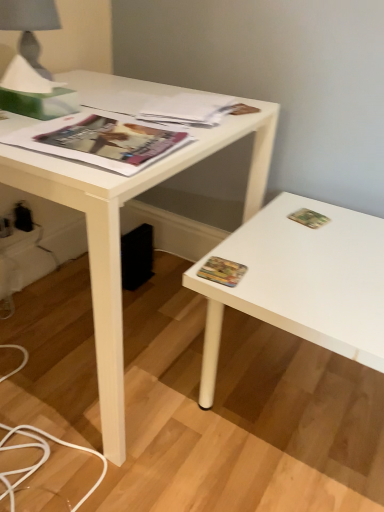
How much space does black plastic electric outlet at lower left, the 2th electric outlet viewed from the front, occupy horizontally?

0.81 inches.

Describe the element at coordinates (222, 271) in the screenshot. I see `multicolored paper at right, which appears as the 2th paperback book when viewed from the back` at that location.

Describe the element at coordinates (6, 226) in the screenshot. I see `white plastic electric outlet at lower left, arranged as the second electric outlet when viewed from the back` at that location.

Locate an element on the screen. The height and width of the screenshot is (512, 384). white plastic electric outlet at lower left, arranged as the second electric outlet when viewed from the back is located at coordinates (6, 226).

The width and height of the screenshot is (384, 512). What do you see at coordinates (309, 218) in the screenshot?
I see `green matte paperback book at upper right, the first paperback book when ordered from right to left` at bounding box center [309, 218].

Locate an element on the screen. The height and width of the screenshot is (512, 384). matte paper magazine at upper center, the 1th magazine viewed from the back is located at coordinates (165, 106).

I want to click on white matte desk at center, so click(119, 230).

Where is `black plastic electric outlet at lower left, which ranks as the 1th electric outlet in back-to-front order`? The image size is (384, 512). black plastic electric outlet at lower left, which ranks as the 1th electric outlet in back-to-front order is located at coordinates [x=23, y=217].

Can black plastic electric outlet at lower left, which ranks as the 1th electric outlet in back-to-front order, be found inside green matte paperback book at upper right, which ranks as the 2th paperback book in front-to-back order?

No, black plastic electric outlet at lower left, which ranks as the 1th electric outlet in back-to-front order, is located outside of green matte paperback book at upper right, which ranks as the 2th paperback book in front-to-back order.

Considering the relative positions of green matte paperback book at upper right, the second paperback book from the left, and black plastic electric outlet at lower left, which ranks as the 1th electric outlet in back-to-front order, in the image provided, is green matte paperback book at upper right, the second paperback book from the left, behind black plastic electric outlet at lower left, which ranks as the 1th electric outlet in back-to-front order,?

No, it is not.

Does matte gray fabric at upper left appear on the right side of matte paper magazine at upper center, the second magazine from the front?

No, matte gray fabric at upper left is not to the right of matte paper magazine at upper center, the second magazine from the front.

Is matte gray fabric at upper left not within matte paper magazine at upper center, the 1th magazine viewed from the back?

matte gray fabric at upper left is positioned outside matte paper magazine at upper center, the 1th magazine viewed from the back.

Does matte gray fabric at upper left have a larger size compared to matte paper magazine at upper center, the second magazine from the front?

Indeed, matte gray fabric at upper left has a larger size compared to matte paper magazine at upper center, the second magazine from the front.

Is point (53, 22) positioned behind point (198, 99)?

No, it is not.

Can you tell me how much white matte desk at center and white plastic electric outlet at lower left, which ranks as the 1th electric outlet in front-to-back order, differ in facing direction?

The angular difference between white matte desk at center and white plastic electric outlet at lower left, which ranks as the 1th electric outlet in front-to-back order, is 2.25 degrees.

Is white matte desk at center surrounding white plastic electric outlet at lower left, which ranks as the 1th electric outlet in front-to-back order?

Yes, white plastic electric outlet at lower left, which ranks as the 1th electric outlet in front-to-back order, can be found within white matte desk at center.

Which of these two, white matte desk at center or white plastic electric outlet at lower left, which ranks as the 1th electric outlet in front-to-back order, is thinner?

Thinner between the two is white plastic electric outlet at lower left, which ranks as the 1th electric outlet in front-to-back order.

From the image's perspective, would you say black plastic electric outlet at lower left, which ranks as the 1th electric outlet in back-to-front order, is positioned over white matte desk at center?

Yes, from the image's perspective, black plastic electric outlet at lower left, which ranks as the 1th electric outlet in back-to-front order, is above white matte desk at center.

From a real-world perspective, is black plastic electric outlet at lower left, the 2th electric outlet viewed from the front, positioned under white matte desk at center based on gravity?

Yes, from a real-world perspective, black plastic electric outlet at lower left, the 2th electric outlet viewed from the front, is beneath white matte desk at center.

Which object is wider, black plastic electric outlet at lower left, which ranks as the 1th electric outlet in back-to-front order, or white matte desk at center?

With larger width is white matte desk at center.

Is matte gray fabric at upper left at the right side of white plastic electric outlet at lower left, which ranks as the 1th electric outlet in front-to-back order?

Yes, matte gray fabric at upper left is to the right of white plastic electric outlet at lower left, which ranks as the 1th electric outlet in front-to-back order.

Is matte gray fabric at upper left next to white plastic electric outlet at lower left, arranged as the second electric outlet when viewed from the back, and touching it?

No, matte gray fabric at upper left is not beside white plastic electric outlet at lower left, arranged as the second electric outlet when viewed from the back.

Could you tell me if matte gray fabric at upper left is facing white plastic electric outlet at lower left, arranged as the second electric outlet when viewed from the back?

No, matte gray fabric at upper left is not facing towards white plastic electric outlet at lower left, arranged as the second electric outlet when viewed from the back.

Who is shorter, matte gray fabric at upper left or white plastic electric outlet at lower left, which ranks as the 1th electric outlet in front-to-back order?

Standing shorter between the two is white plastic electric outlet at lower left, which ranks as the 1th electric outlet in front-to-back order.

What's the angular difference between matte gray fabric at upper left and white matte desk at center's facing directions?

There is a 2.24-degree angle between the facing directions of matte gray fabric at upper left and white matte desk at center.

Is matte gray fabric at upper left touching white matte desk at center?

No, matte gray fabric at upper left is not next to white matte desk at center.

How distant is matte gray fabric at upper left from white matte desk at center?

38.10 centimeters.

Based on the photo, considering the positions of objects matte gray fabric at upper left and white matte desk at center in the image provided, who is more to the right, matte gray fabric at upper left or white matte desk at center?

From the viewer's perspective, white matte desk at center appears more on the right side.

From the image's perspective, is white matte desk at center above or below matte gray fabric at upper left?

Based on their image positions, white matte desk at center is located beneath matte gray fabric at upper left.

Could you tell me if white matte desk at center is facing matte gray fabric at upper left?

No, white matte desk at center is not oriented towards matte gray fabric at upper left.

Considering their positions, is white matte desk at center located in front of or behind matte gray fabric at upper left?

Clearly, white matte desk at center is in front of matte gray fabric at upper left.

Between white matte desk at center and matte gray fabric at upper left, which one has larger width?

Wider between the two is white matte desk at center.

The width and height of the screenshot is (384, 512). I want to click on the 2nd paperback book to the right of the black plastic electric outlet at lower left, the 2th electric outlet viewed from the front, starting your count from the anchor, so click(x=309, y=218).

You are a GUI agent. You are given a task and a screenshot of the screen. Output one action in this format:
    pyautogui.click(x=<x>, y=<y>)
    Task: Click on the table lamp on the left of matte paper magazine at upper center, the 1th magazine viewed from the back
    This screenshot has height=512, width=384.
    Given the screenshot: What is the action you would take?
    pyautogui.click(x=29, y=26)

From the image, which object appears to be farther from matte paper magazine at upper left, which is counted as the second magazine, starting from the back, green matte paperback book at upper right, placed as the first paperback book when sorted from back to front, or white matte desk at center?

green matte paperback book at upper right, placed as the first paperback book when sorted from back to front.

From the picture: From the image, which object appears to be farther from black plastic electric outlet at lower left, which ranks as the 1th electric outlet in back-to-front order, multicolored paper at right, arranged as the first paperback book when ordered from the bottom, or white matte desk at center?

multicolored paper at right, arranged as the first paperback book when ordered from the bottom.

Based on their spatial positions, is matte gray fabric at upper left or multicolored paper at right, arranged as the first paperback book when ordered from the bottom, further from black plastic electric outlet at lower left, which ranks as the 1th electric outlet in back-to-front order?

multicolored paper at right, arranged as the first paperback book when ordered from the bottom.

In the scene shown: Looking at the image, which one is located further to matte gray fabric at upper left, white plastic electric outlet at lower left, which ranks as the 1th electric outlet in front-to-back order, or matte paper magazine at upper center, the 1th magazine viewed from the back?

The object further to matte gray fabric at upper left is white plastic electric outlet at lower left, which ranks as the 1th electric outlet in front-to-back order.

Which object lies nearer to the anchor point matte paper magazine at upper center, the 1th magazine viewed from the back, green matte paperback book at upper right, the second paperback book from the left, or matte gray fabric at upper left?

Based on the image, matte gray fabric at upper left appears to be nearer to matte paper magazine at upper center, the 1th magazine viewed from the back.

From the image, which object appears to be farther from multicolored paper at right, which appears as the 2th paperback book when viewed from the back, matte paper magazine at upper left, positioned as the first magazine in front-to-back order, or matte paper magazine at upper center, the 1th magazine viewed from the back?

matte paper magazine at upper center, the 1th magazine viewed from the back, lies further to multicolored paper at right, which appears as the 2th paperback book when viewed from the back, than the other object.

Consider the image. Which object lies further to the anchor point white matte desk at center, matte paper magazine at upper left, positioned as the first magazine in front-to-back order, or white plastic electric outlet at lower left, arranged as the second electric outlet when viewed from the back?

white plastic electric outlet at lower left, arranged as the second electric outlet when viewed from the back.

Which object lies nearer to the anchor point multicolored paper at right, arranged as the first paperback book when ordered from the bottom, matte paper magazine at upper center, the 1th magazine viewed from the back, or white plastic electric outlet at lower left, which ranks as the 1th electric outlet in front-to-back order?

The object closer to multicolored paper at right, arranged as the first paperback book when ordered from the bottom, is matte paper magazine at upper center, the 1th magazine viewed from the back.

Identify the location of electric outlet between white plastic electric outlet at lower left, arranged as the second electric outlet when viewed from the back, and matte paper magazine at upper center, the 1th magazine viewed from the back, from left to right. The image size is (384, 512). (23, 217).

Where is `table lamp between white matte desk at center and black plastic electric outlet at lower left, which ranks as the 1th electric outlet in back-to-front order, along the z-axis`? This screenshot has height=512, width=384. table lamp between white matte desk at center and black plastic electric outlet at lower left, which ranks as the 1th electric outlet in back-to-front order, along the z-axis is located at coordinates 29,26.

Image resolution: width=384 pixels, height=512 pixels. I want to click on table lamp between black plastic electric outlet at lower left, which ranks as the 1th electric outlet in back-to-front order, and green matte paperback book at upper right, the first paperback book when ordered from right to left, from left to right, so 29,26.

Where is `paperback book between matte gray fabric at upper left and green matte paperback book at upper right, the second paperback book from the left, in the horizontal direction`? The height and width of the screenshot is (512, 384). paperback book between matte gray fabric at upper left and green matte paperback book at upper right, the second paperback book from the left, in the horizontal direction is located at coordinates (222, 271).